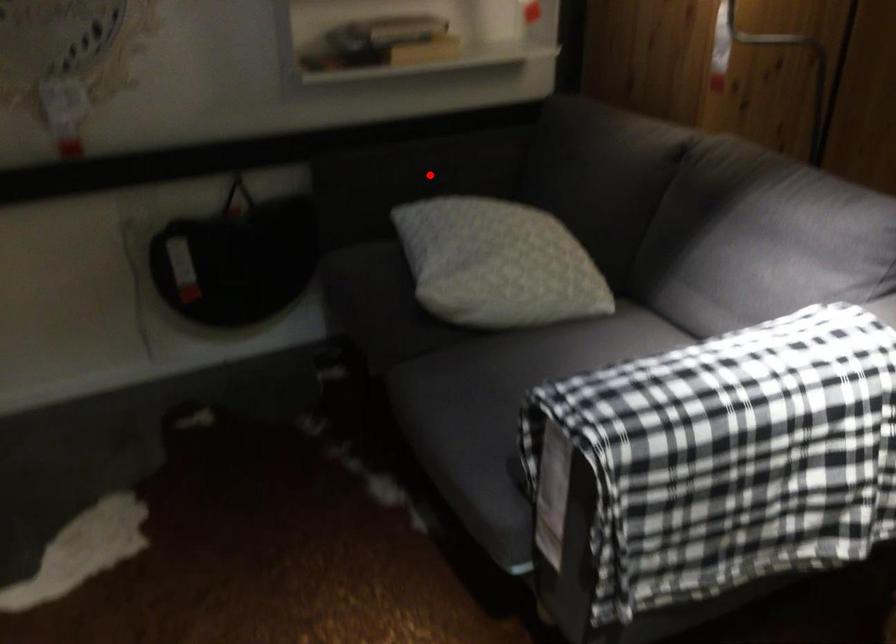
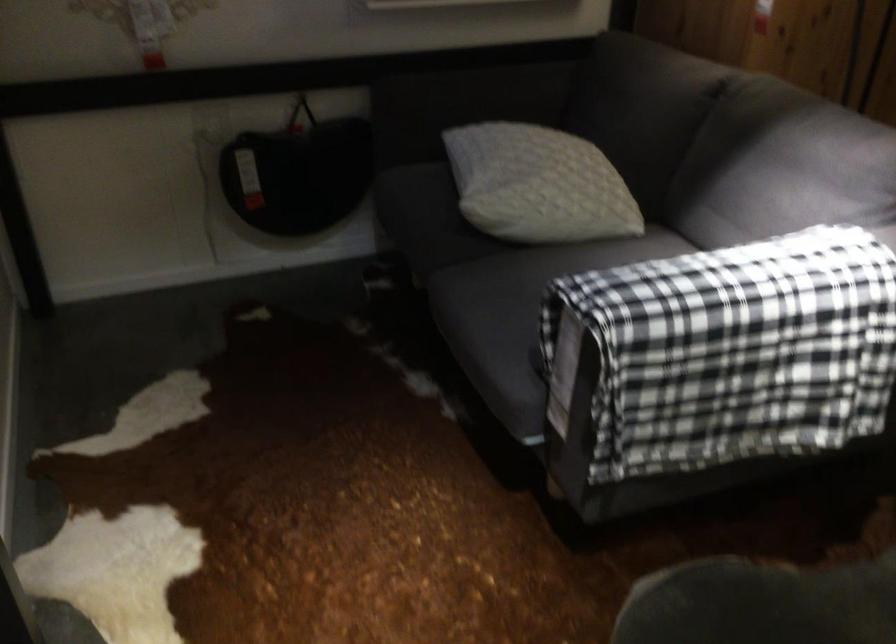
Locate, in the second image, the point that corresponds to the highlighted location in the first image.

(478, 98)